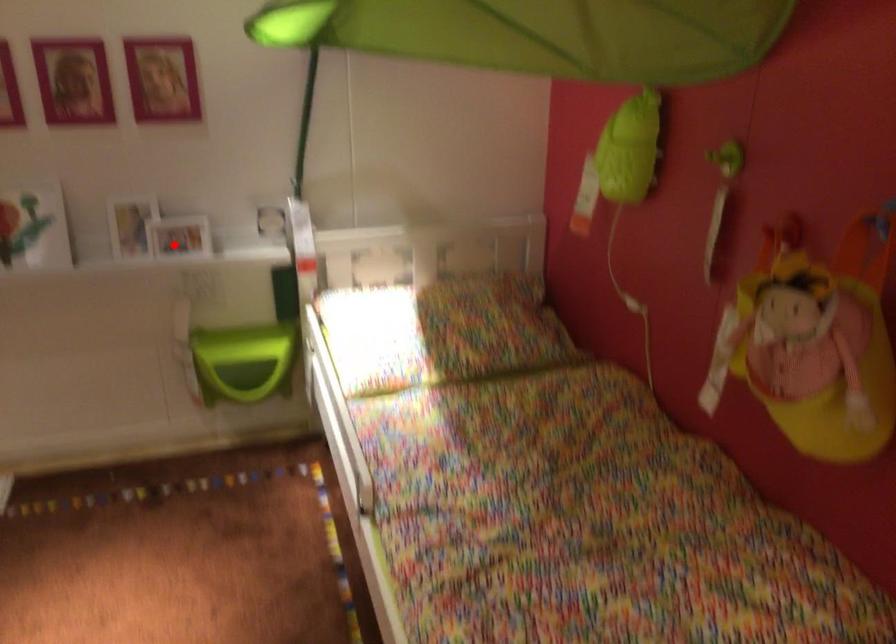
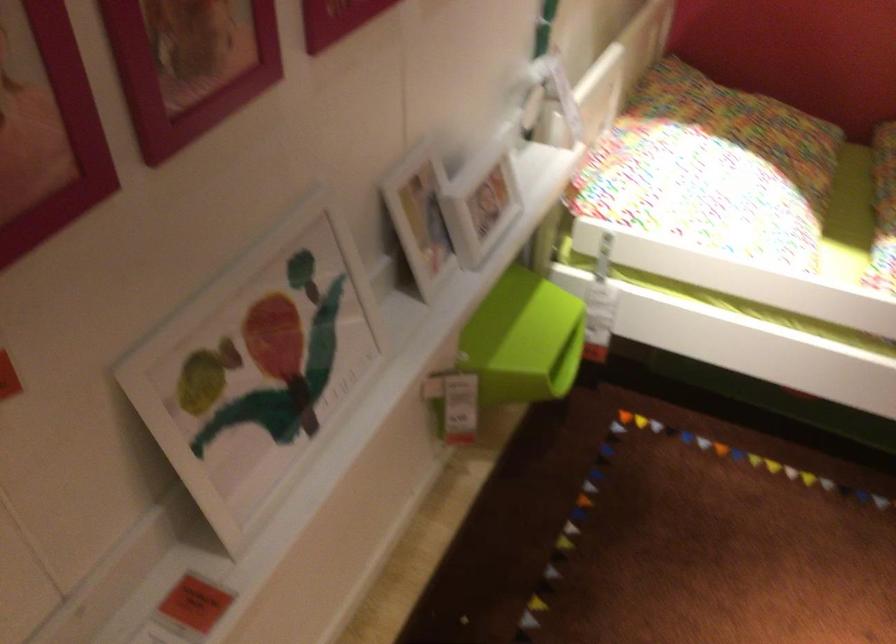
Question: A red point is marked in image1. In image2, is the corresponding 3D point closer to the camera or farther? Reply with the corresponding letter.

Choices:
 (A) The corresponding 3D point is closer.
 (B) The corresponding 3D point is farther.

Answer: (A)